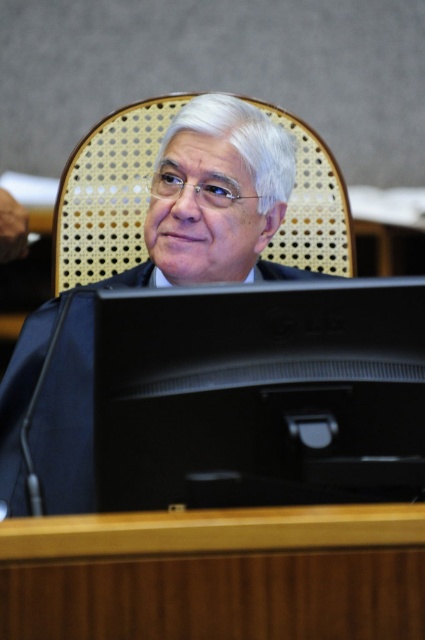
Question: Which point is farther to the camera?

Choices:
 (A) black matte suit at center
 (B) brown woven chair at center
 (C) black glossy monitor at center
 (D) wooden table at center

Answer: (B)

Question: Observing the image, what is the correct spatial positioning of wooden table at center in reference to brown woven chair at center?

Choices:
 (A) right
 (B) left

Answer: (A)

Question: Is wooden table at center to the right of black matte suit at center from the viewer's perspective?

Choices:
 (A) yes
 (B) no

Answer: (A)

Question: Estimate the real-world distances between objects in this image. Which object is closer to the black glossy monitor at center?

Choices:
 (A) brown woven chair at center
 (B) black matte suit at center
 (C) wooden table at center

Answer: (C)

Question: Considering the relative positions of black glossy monitor at center and brown woven chair at center in the image provided, where is black glossy monitor at center located with respect to brown woven chair at center?

Choices:
 (A) below
 (B) above

Answer: (A)

Question: Which object is the farthest from the brown woven chair at center?

Choices:
 (A) black glossy monitor at center
 (B) black matte suit at center
 (C) wooden table at center

Answer: (C)